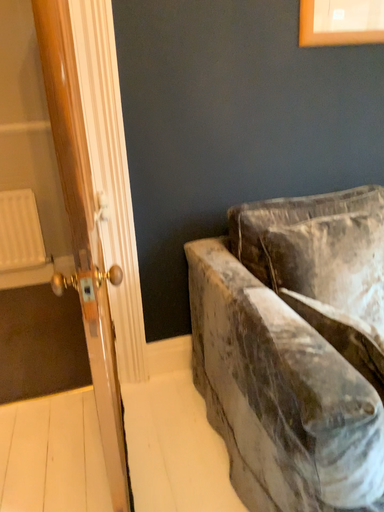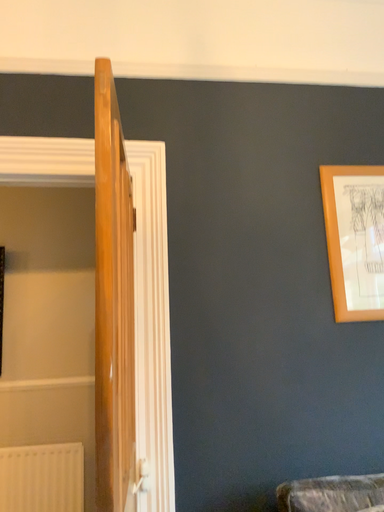
Question: How did the camera likely rotate when shooting the video?

Choices:
 (A) rotated right
 (B) rotated left

Answer: (B)